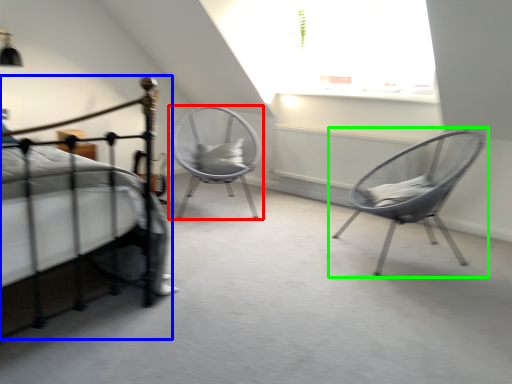
Question: Which is farther away from chair (highlighted by a red box)? bed (highlighted by a blue box) or chair (highlighted by a green box)?

Choices:
 (A) bed
 (B) chair

Answer: (A)